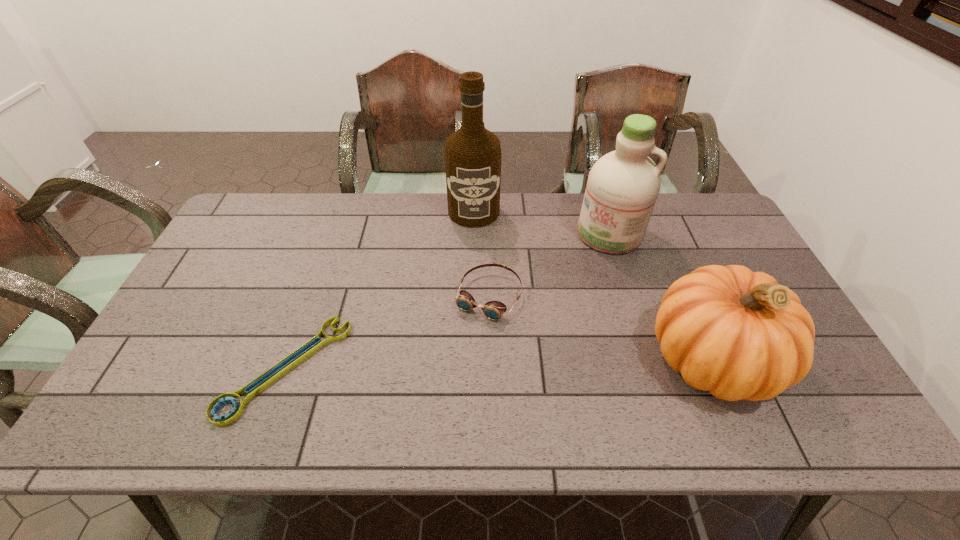
You are a GUI agent. You are given a task and a screenshot of the screen. Output one action in this format:
    pyautogui.click(x=<x>, y=<y>)
    Task: Click on the free space between the third shortest object and the fourth tallest object
    The height and width of the screenshot is (540, 960).
    Given the screenshot: What is the action you would take?
    pyautogui.click(x=600, y=327)

Locate an element on the screen. vacant area that lies between the third shortest object and the fourth tallest object is located at coordinates (600, 327).

Where is `vacant space that's between the cleansing agent and the alcohol`? Image resolution: width=960 pixels, height=540 pixels. vacant space that's between the cleansing agent and the alcohol is located at coordinates (541, 223).

The height and width of the screenshot is (540, 960). Identify the location of empty space between the shortest object and the pumpkin. (498, 363).

Identify the location of free space that is in between the leftmost object and the second tallest object. The height and width of the screenshot is (540, 960). (447, 301).

The width and height of the screenshot is (960, 540). I want to click on free area in between the pumpkin and the alcohol, so click(592, 285).

Where is `free spot between the third shortest object and the alcohol`? free spot between the third shortest object and the alcohol is located at coordinates (592, 285).

Find the location of a particular element. This screenshot has width=960, height=540. vacant area between the goggles and the cleansing agent is located at coordinates (549, 265).

At what (x,y) coordinates should I click in order to perform the action: click on object that is the fourth closest one to the shortest object. Please return your answer as a coordinate pair (x, y). Looking at the image, I should click on tap(738, 334).

Select which object appears as the third closest to the alcohol. Please provide its 2D coordinates. Your answer should be formatted as a tuple, i.e. [(x, y)], where the tuple contains the x and y coordinates of a point satisfying the conditions above.

[(261, 382)]